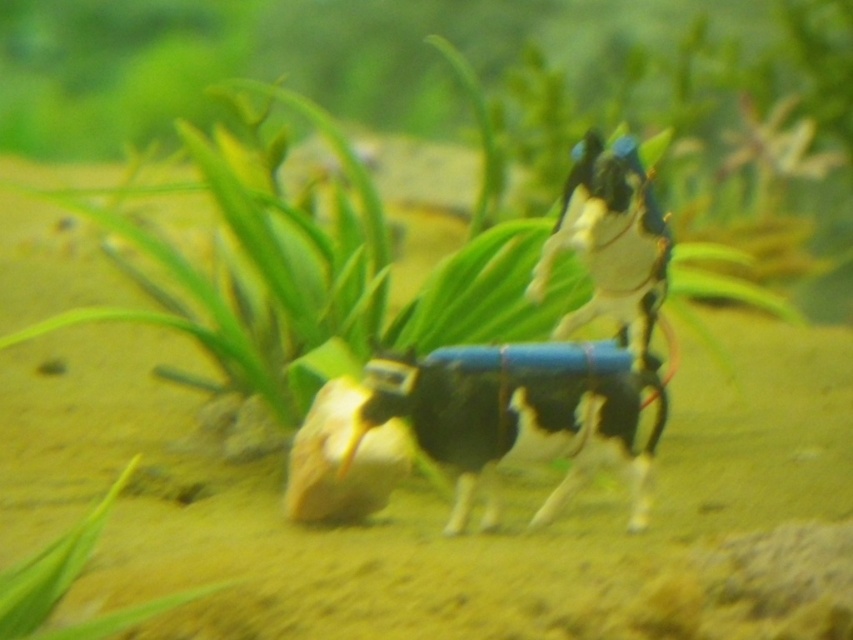
Question: Which point is farther to the camera?

Choices:
 (A) green leafy plant at lower left
 (B) shiny blue plastic crab at center
 (C) black matte cow at center

Answer: (C)

Question: Considering the real-world distances, which object is farthest from the black matte cow at center?

Choices:
 (A) shiny blue plastic crab at center
 (B) green leafy plant at lower left

Answer: (B)

Question: Is shiny blue plastic crab at center closer to camera compared to green leafy plant at lower left?

Choices:
 (A) no
 (B) yes

Answer: (A)

Question: Does black matte cow at center have a lesser width compared to green leafy plant at lower left?

Choices:
 (A) yes
 (B) no

Answer: (B)

Question: Is black matte cow at center to the right of shiny blue plastic crab at center from the viewer's perspective?

Choices:
 (A) no
 (B) yes

Answer: (A)

Question: Estimate the real-world distances between objects in this image. Which object is farther from the shiny blue plastic crab at center?

Choices:
 (A) black matte cow at center
 (B) green leafy plant at lower left

Answer: (B)